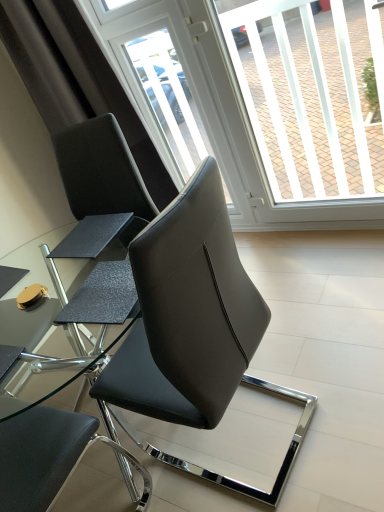
What are the coordinates of `free spot below black leather chair at center, which is the 1th chair from front to back (from a real-world perspective)` in the screenshot? It's located at (258, 435).